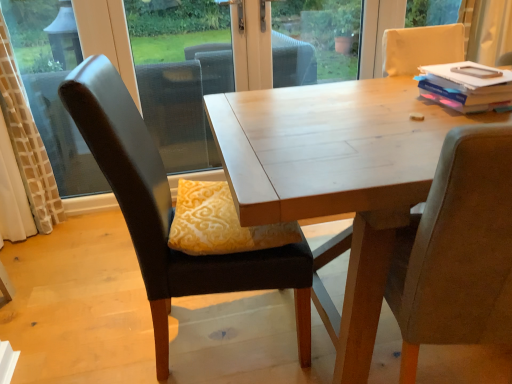
Question: Does hardcover book at upper right have a greater height compared to matte black chair at left, the first chair from the left?

Choices:
 (A) yes
 (B) no

Answer: (B)

Question: Can you confirm if hardcover book at upper right is thinner than matte black chair at left, the first chair from the left?

Choices:
 (A) yes
 (B) no

Answer: (A)

Question: Does hardcover book at upper right have a greater width compared to matte black chair at left, the second chair when ordered from right to left?

Choices:
 (A) yes
 (B) no

Answer: (B)

Question: From a real-world perspective, is hardcover book at upper right physically above matte black chair at left, the second chair when ordered from right to left?

Choices:
 (A) no
 (B) yes

Answer: (B)

Question: Is hardcover book at upper right positioned far away from matte black chair at left, the second chair when ordered from right to left?

Choices:
 (A) yes
 (B) no

Answer: (B)

Question: From a real-world perspective, is yellow velvet pillow at center physically located above or below matte black chair at left, the first chair from the left?

Choices:
 (A) below
 (B) above

Answer: (B)

Question: Looking at the image, does yellow velvet pillow at center seem bigger or smaller compared to matte black chair at left, the second chair when ordered from right to left?

Choices:
 (A) small
 (B) big

Answer: (A)

Question: From the image's perspective, relative to matte black chair at left, the first chair from the left, is yellow velvet pillow at center above or below?

Choices:
 (A) below
 (B) above

Answer: (B)

Question: In terms of height, does yellow velvet pillow at center look taller or shorter compared to matte black chair at left, the first chair from the left?

Choices:
 (A) tall
 (B) short

Answer: (B)

Question: Would you say matte black chair at left, the first chair from the left, is inside or outside yellow velvet pillow at center?

Choices:
 (A) inside
 (B) outside

Answer: (B)

Question: Is point (105, 89) closer or farther from the camera than point (224, 243)?

Choices:
 (A) farther
 (B) closer

Answer: (B)

Question: From the image's perspective, is matte black chair at left, the second chair when ordered from right to left, located above or below yellow velvet pillow at center?

Choices:
 (A) below
 (B) above

Answer: (A)

Question: Looking at the image, does matte black chair at left, the second chair when ordered from right to left, seem bigger or smaller compared to yellow velvet pillow at center?

Choices:
 (A) big
 (B) small

Answer: (A)

Question: Relative to hardcover book at upper right, is matte gray chair at right, which is the 1th chair in right-to-left order, in front or behind?

Choices:
 (A) behind
 (B) front

Answer: (B)

Question: Does point (445, 198) appear closer or farther from the camera than point (480, 102)?

Choices:
 (A) closer
 (B) farther

Answer: (A)